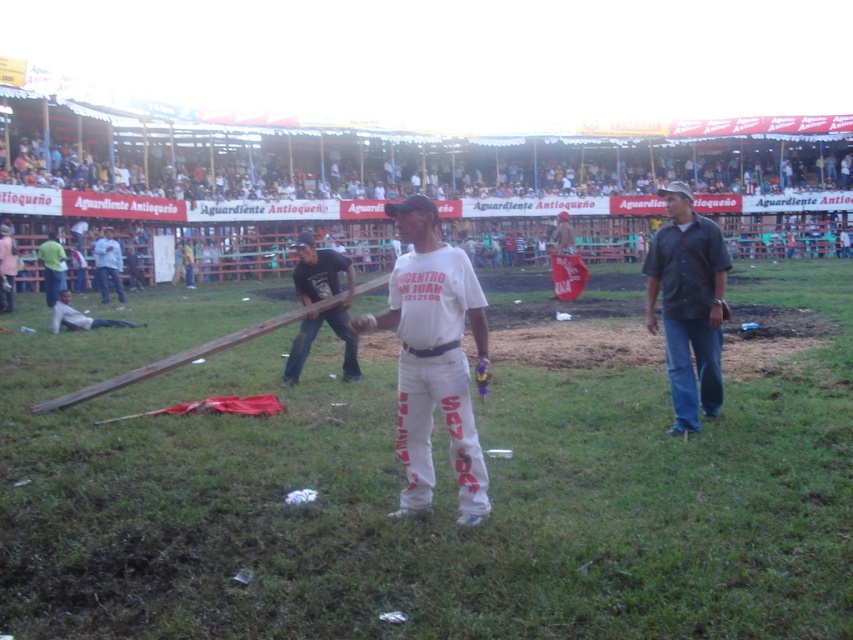
Question: Can you confirm if light gray cotton shirt at center is positioned above green fabric shirt at upper left?

Choices:
 (A) yes
 (B) no

Answer: (A)

Question: Among these objects, which one is nearest to the camera?

Choices:
 (A) white cotton shirt at center
 (B) light gray cotton shirt at center
 (C) dark blue shirt at right

Answer: (A)

Question: Which object is positioned farthest from the white cotton shirt at center?

Choices:
 (A) dark blue shirt at right
 (B) green fabric shirt at upper left

Answer: (B)

Question: Is white cotton shirt at center below light gray cotton shirt at center?

Choices:
 (A) no
 (B) yes

Answer: (B)

Question: From the image, what is the correct spatial relationship of white cotton shirt at center in relation to dark blue jeans at center?

Choices:
 (A) right
 (B) left

Answer: (A)

Question: Which object is closer to the camera taking this photo?

Choices:
 (A) dark blue shirt at right
 (B) dark blue jeans at center

Answer: (A)